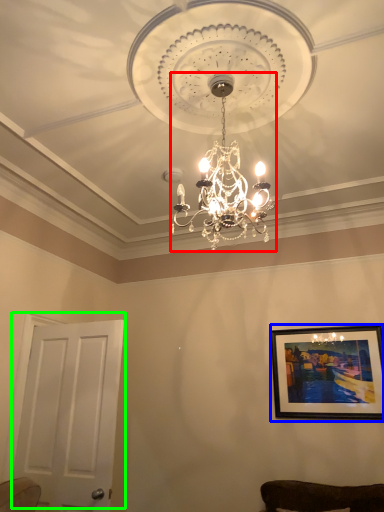
Question: Based on their relative distances, which object is farther from lamp (highlighted by a red box)? Choose from picture frame (highlighted by a blue box) and door (highlighted by a green box).

Choices:
 (A) picture frame
 (B) door

Answer: (A)